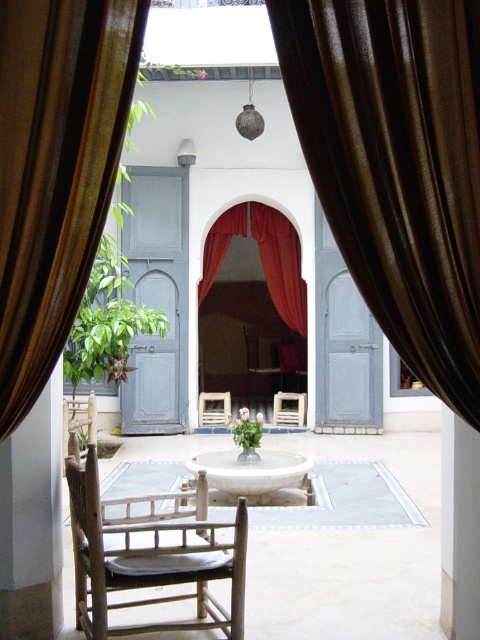
You are trying to decide whether to place a new rectangular table that is 1.5 meters wide in the courtyard. The table must be placed between the brown sheer curtain at left and the wooden rocking chair at center. Based on the space available between them, will the table fit?

The brown sheer curtain at left is narrower than the wooden rocking chair at center. However, the exact distance between them isn

You are standing in the doorway looking at the courtyard. There are two points marked in the scene, one at point coordinates point (58, 248) and another at point coordinates point (231, 493). Which point is closer to you?

Point (58, 248) is closer to the viewer than point (231, 493).